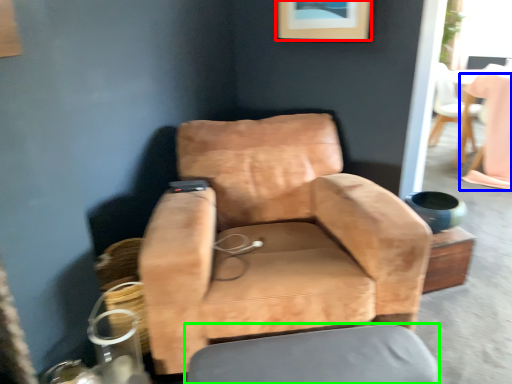
Question: Which object is positioned closest to picture frame (highlighted by a red box)? Select from table (highlighted by a blue box) and swivel chair (highlighted by a green box).

Choices:
 (A) table
 (B) swivel chair

Answer: (B)